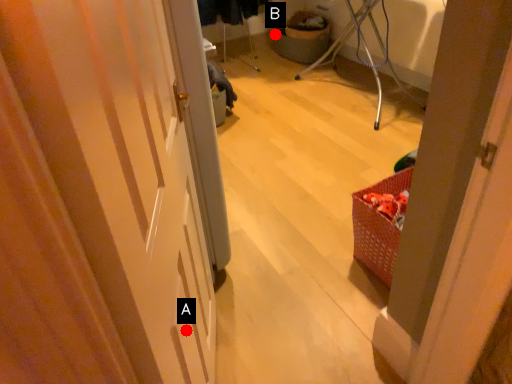
Question: Two points are circled on the image, labeled by A and B beside each circle. Which of the following is the closest to the observer?

Choices:
 (A) A is closer
 (B) B is closer

Answer: (A)